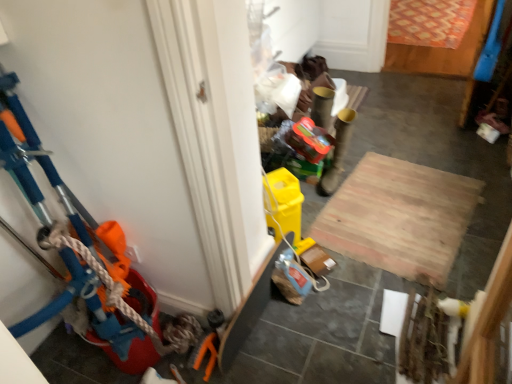
What do you see at coordinates (48, 178) in the screenshot? The height and width of the screenshot is (384, 512). I see `matte plastic bucket at left` at bounding box center [48, 178].

At what (x,y) coordinates should I click in order to perform the action: click on matte plastic bucket at left. Please return your answer as a coordinate pair (x, y). This screenshot has height=384, width=512. Looking at the image, I should click on (48, 178).

This screenshot has width=512, height=384. I want to click on wooden at center, so click(399, 218).

The image size is (512, 384). What do you see at coordinates (399, 218) in the screenshot?
I see `wooden at center` at bounding box center [399, 218].

Measure the distance between point (x=366, y=186) and camera.

Point (x=366, y=186) is 2.31 meters from camera.

Find the location of `matte plastic bucket at left`. matte plastic bucket at left is located at coordinates (48, 178).

Looking at this image, considering the relative positions of wooden at center and matte plastic bucket at left in the image provided, is wooden at center to the right of matte plastic bucket at left from the viewer's perspective?

Indeed, wooden at center is positioned on the right side of matte plastic bucket at left.

Is wooden at center positioned before matte plastic bucket at left?

No, wooden at center is behind matte plastic bucket at left.

Is point (440, 254) closer or farther from the camera than point (152, 320)?

Clearly, point (440, 254) is more distant from the camera than point (152, 320).

Based on the photo, from the image's perspective, is wooden at center located above matte plastic bucket at left?

Incorrect, from the image's perspective, wooden at center is lower than matte plastic bucket at left.

From a real-world perspective, is wooden at center beneath matte plastic bucket at left?

Yes, from a real-world perspective, wooden at center is beneath matte plastic bucket at left.

Which of these two, wooden at center or matte plastic bucket at left, is thinner?

With smaller width is matte plastic bucket at left.

Which of these two, wooden at center or matte plastic bucket at left, stands shorter?

wooden at center.

Considering the relative sizes of wooden at center and matte plastic bucket at left in the image provided, is wooden at center smaller than matte plastic bucket at left?

Correct, wooden at center occupies less space than matte plastic bucket at left.

Do you think wooden at center is within matte plastic bucket at left, or outside of it?

The correct answer is: outside.

Are wooden at center and matte plastic bucket at left far apart?

Absolutely, wooden at center is distant from matte plastic bucket at left.

Based on the photo, could you tell me if wooden at center is turned towards matte plastic bucket at left?

No, wooden at center is not facing towards matte plastic bucket at left.

I want to click on toy above the wooden at center (from a real-world perspective), so click(x=48, y=178).

Can you confirm if matte plastic bucket at left is positioned to the left of wooden at center?

Correct, you'll find matte plastic bucket at left to the left of wooden at center.

Which object is closer to the camera taking this photo, matte plastic bucket at left or wooden at center?

matte plastic bucket at left is more forward.

Is point (125, 361) positioned in front of point (319, 217)?

Yes.

From the image's perspective, who appears lower, matte plastic bucket at left or wooden at center?

wooden at center, from the image's perspective.

Consider the image. From a real-world perspective, which object rests below the other?

wooden at center, from a real-world perspective.

Considering the sizes of objects matte plastic bucket at left and wooden at center in the image provided, who is thinner, matte plastic bucket at left or wooden at center?

With smaller width is matte plastic bucket at left.

Considering the relative sizes of matte plastic bucket at left and wooden at center in the image provided, is matte plastic bucket at left taller than wooden at center?

Indeed, matte plastic bucket at left has a greater height compared to wooden at center.

Between matte plastic bucket at left and wooden at center, which one has smaller size?

Smaller between the two is wooden at center.

Can wooden at center be found inside matte plastic bucket at left?

Actually, wooden at center is outside matte plastic bucket at left.

Is matte plastic bucket at left placed right next to wooden at center?

No, matte plastic bucket at left is not with wooden at center.

Is wooden at center at the back of matte plastic bucket at left?

No, matte plastic bucket at left's orientation is not away from wooden at center.

How many degrees apart are the facing directions of matte plastic bucket at left and wooden at center?

172 degrees separate the facing orientations of matte plastic bucket at left and wooden at center.

Find the location of `plywood behind the matte plastic bucket at left`. plywood behind the matte plastic bucket at left is located at coordinates (399, 218).

What are the coordinates of `plywood on the right of matte plastic bucket at left` in the screenshot? It's located at (399, 218).

At what (x,y) coordinates should I click in order to perform the action: click on plywood located underneath the matte plastic bucket at left (from a real-world perspective). Please return your answer as a coordinate pair (x, y). This screenshot has height=384, width=512. Looking at the image, I should click on (399, 218).